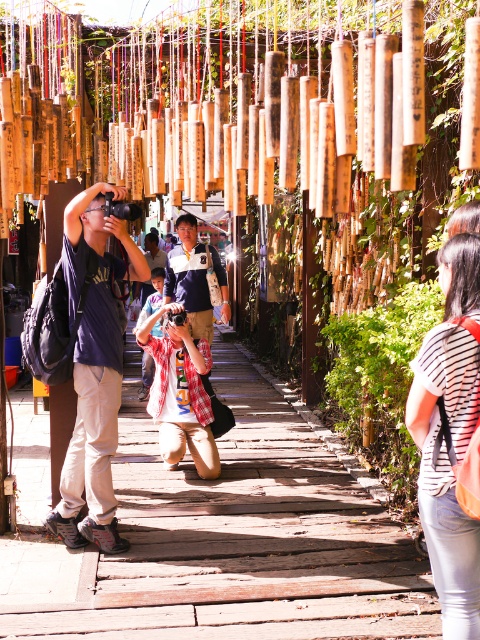
You are a photographer standing in the traditional Japanese wind chime alleyway. You see a wooden walkway at center and a matte blue shirt at center. Which object is located to the right of the other?

The wooden walkway at center is positioned on the right side of matte blue shirt at center, so the wooden walkway at center is to the right of the matte blue shirt at center.

You are a photographer in the wind chime alleyway. You notice two people wearing striped cotton shirt at right and matte blue shirt at center. Which person is wearing a smaller sized shirt?

The striped cotton shirt at right has a smaller size compared to matte blue shirt at center, so the person wearing the striped cotton shirt at right is the one with the smaller sized shirt.